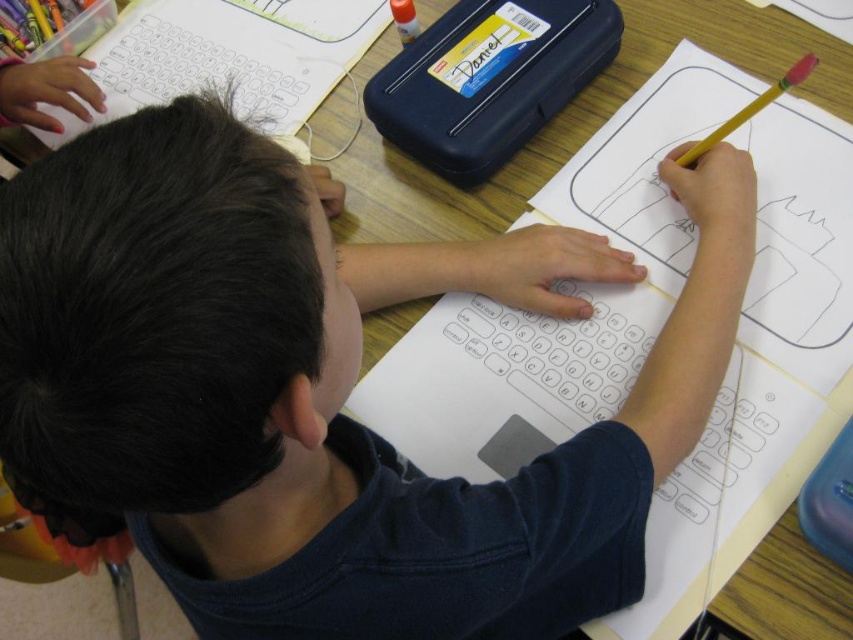
You are a teacher observing a child at their desk. You notice the yellow plastic nameplate at upper center and the yellow wood pencil at upper right. Which object is located to the left of the other?

The yellow plastic nameplate at upper center is positioned on the left side of yellow wood pencil at upper right.

What are the coordinates of the yellow plastic nameplate at upper center in the image?

The coordinates of the yellow plastic nameplate at upper center are at point (479, 56).

You are a teacher observing a child at a desk. The child is using a yellow pencil with a pink eraser tip to draw on a paper with a keyboard outline. You notice a point at coordinates (479, 56). What object is located at that point?

The point at coordinates (479, 56) corresponds to the yellow plastic nameplate at upper center.